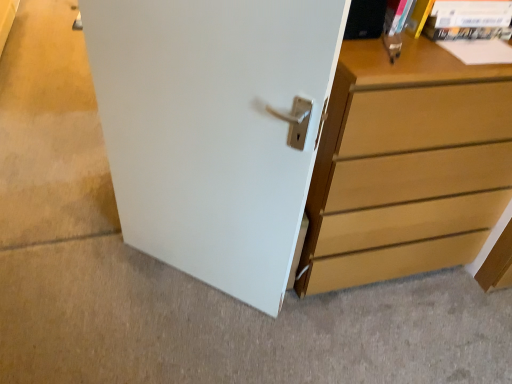
Question: Can you confirm if white matte door at center is thinner than white smooth door at center?

Choices:
 (A) yes
 (B) no

Answer: (A)

Question: From the image's perspective, is white matte door at center on white smooth door at center?

Choices:
 (A) yes
 (B) no

Answer: (A)

Question: Considering the relative positions of white matte door at center and white smooth door at center in the image provided, is white matte door at center behind white smooth door at center?

Choices:
 (A) no
 (B) yes

Answer: (A)

Question: Is white matte door at center to the left of white smooth door at center from the viewer's perspective?

Choices:
 (A) no
 (B) yes

Answer: (B)

Question: From a real-world perspective, is white matte door at center positioned over white smooth door at center based on gravity?

Choices:
 (A) no
 (B) yes

Answer: (B)

Question: Is white matte door at center oriented towards white smooth door at center?

Choices:
 (A) yes
 (B) no

Answer: (B)

Question: Is light brown wood chest of drawers at right bigger than white smooth door at center?

Choices:
 (A) yes
 (B) no

Answer: (A)

Question: From the image's perspective, is light brown wood chest of drawers at right on white smooth door at center?

Choices:
 (A) no
 (B) yes

Answer: (B)

Question: From a real-world perspective, is light brown wood chest of drawers at right over white smooth door at center?

Choices:
 (A) no
 (B) yes

Answer: (B)

Question: Does light brown wood chest of drawers at right turn towards white smooth door at center?

Choices:
 (A) yes
 (B) no

Answer: (B)

Question: Is light brown wood chest of drawers at right not inside white smooth door at center?

Choices:
 (A) yes
 (B) no

Answer: (A)

Question: Considering the relative sizes of light brown wood chest of drawers at right and white smooth door at center in the image provided, is light brown wood chest of drawers at right wider than white smooth door at center?

Choices:
 (A) no
 (B) yes

Answer: (A)

Question: Is white smooth door at center thinner than light brown wood chest of drawers at right?

Choices:
 (A) no
 (B) yes

Answer: (A)